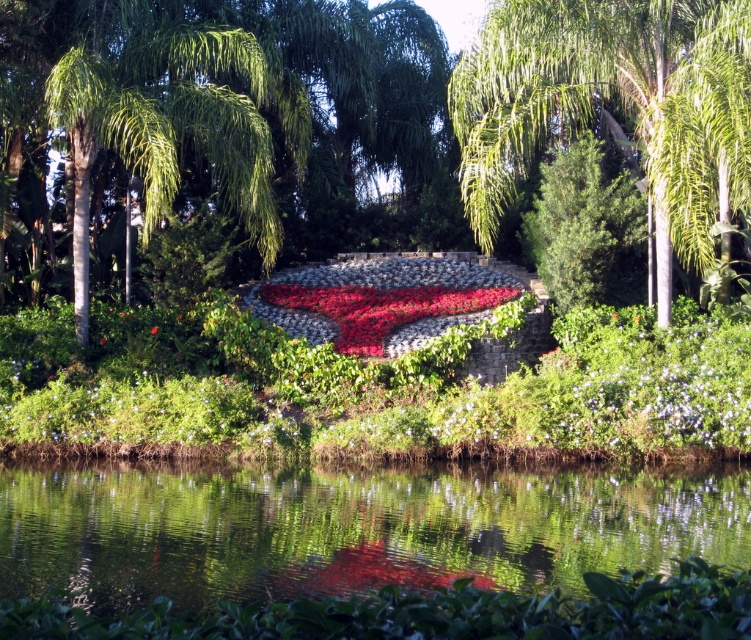
Question: Which object appears farthest from the camera in this image?

Choices:
 (A) green leafy palm tree at center
 (B) red matte flower at center

Answer: (B)

Question: Which object is farther from the camera taking this photo?

Choices:
 (A) red matte flower at center
 (B) green textured bush at center
 (C) red fabric flower at center

Answer: (B)

Question: Can you confirm if green reflective water at center is wider than green textured bush at center?

Choices:
 (A) yes
 (B) no

Answer: (A)

Question: Does green reflective water at center appear over green textured bush at center?

Choices:
 (A) no
 (B) yes

Answer: (A)

Question: Can you confirm if red fabric flower at center is positioned to the left of green textured bush at center?

Choices:
 (A) yes
 (B) no

Answer: (A)

Question: Which object is the closest to the green textured bush at center?

Choices:
 (A) green reflective water at center
 (B) red fabric flower at center

Answer: (B)